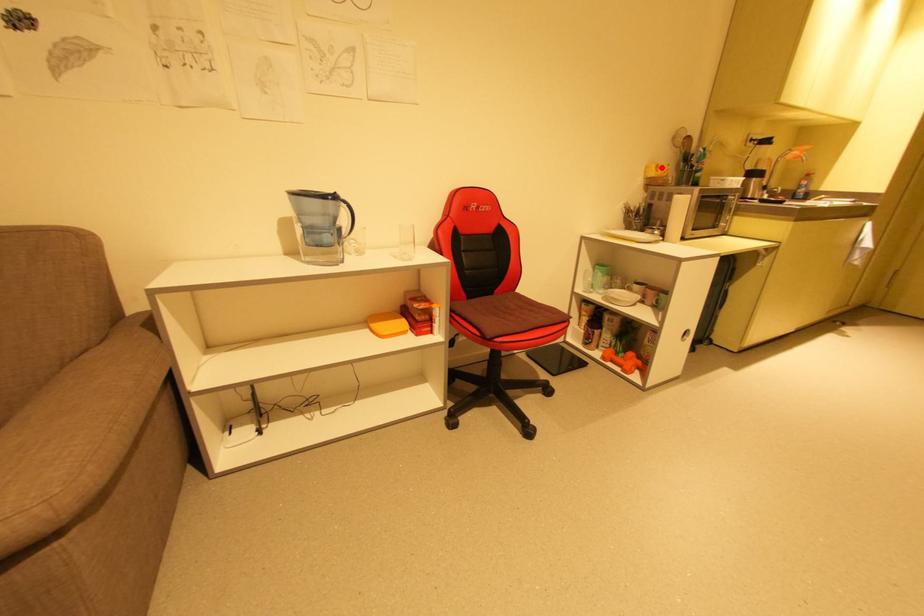
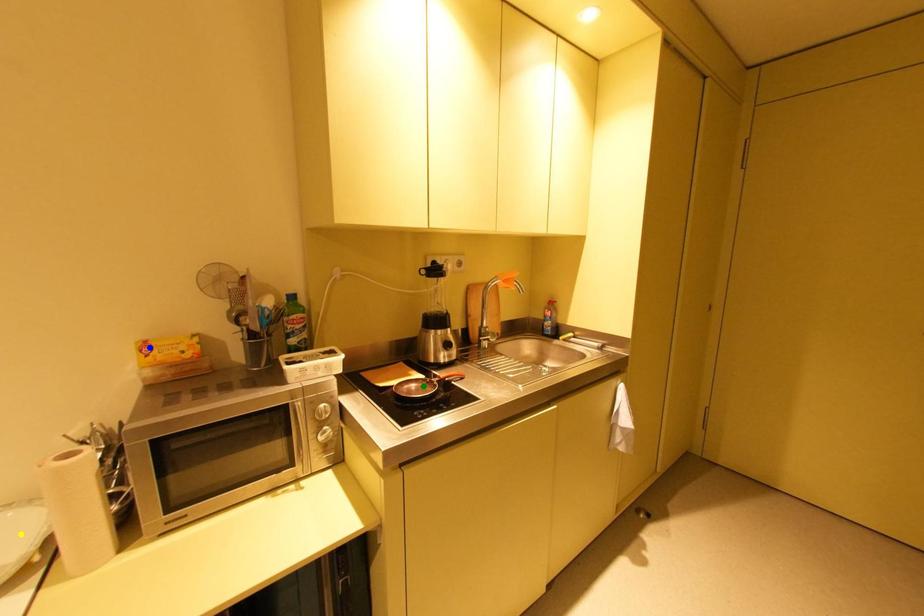
Question: I am providing you with two images of the same scene from different viewpoints. A red point is marked on the first image. You are given multiple points on the second image. Which spot in image 2 lines up with the point in image 1?

Choices:
 (A) blue point
 (B) green point
 (C) yellow point

Answer: (A)